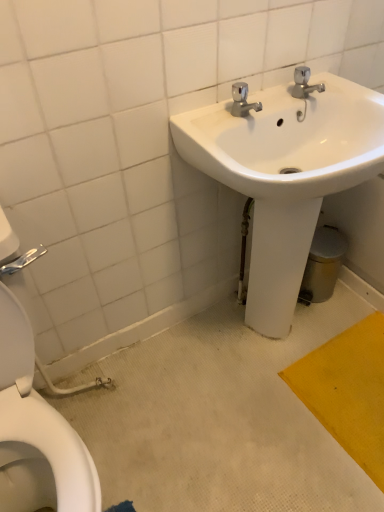
Question: From a real-world perspective, is white glossy toilet at left positioned above or below white glossy sink at upper right?

Choices:
 (A) below
 (B) above

Answer: (B)

Question: In the image, is white glossy toilet at left positioned in front of or behind white glossy sink at upper right?

Choices:
 (A) front
 (B) behind

Answer: (A)

Question: Considering the positions of white glossy toilet at left and white glossy sink at upper right in the image, is white glossy toilet at left taller or shorter than white glossy sink at upper right?

Choices:
 (A) tall
 (B) short

Answer: (A)

Question: Is white glossy sink at upper right inside the boundaries of white glossy toilet at left, or outside?

Choices:
 (A) inside
 (B) outside

Answer: (B)

Question: From their relative heights in the image, would you say white glossy sink at upper right is taller or shorter than white glossy toilet at left?

Choices:
 (A) tall
 (B) short

Answer: (B)

Question: Relative to white glossy toilet at left, is white glossy sink at upper right in front or behind?

Choices:
 (A) behind
 (B) front

Answer: (A)

Question: Considering the positions of white glossy sink at upper right and white glossy toilet at left in the image, is white glossy sink at upper right wider or thinner than white glossy toilet at left?

Choices:
 (A) thin
 (B) wide

Answer: (A)